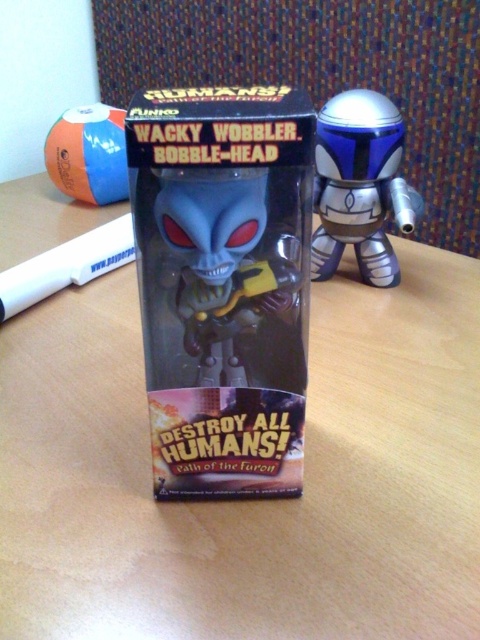
You are a collector examining the packaging of the Wacky Wobbler Bobble Head. You notice two points marked on the box. The first point is at coordinates point [372,275] and the second is at point [88,157]. Which point is nearer to your eyes?

Point [372,275] is closer to the camera than point [88,157], so the first point is nearer to your eyes.

You are organizing a desk and need to move items to make space. You see the orange rubber ball at upper left and the white plastic pen at lower left. Which item is closer to you when looking at the scene?

The orange rubber ball at upper left is closer to you because the white plastic pen at lower left is behind it.

You are a delivery person standing at the point marked as point [315,349]. You need to place a package that is 1.1 meters long on the floor without tilting it. Is there enough space between you and the camera to place the package?

The distance between point [315,349] and the camera is 1.08 meters. Since the package is 1.1 meters long, there isn not enough space to place it without tilting.